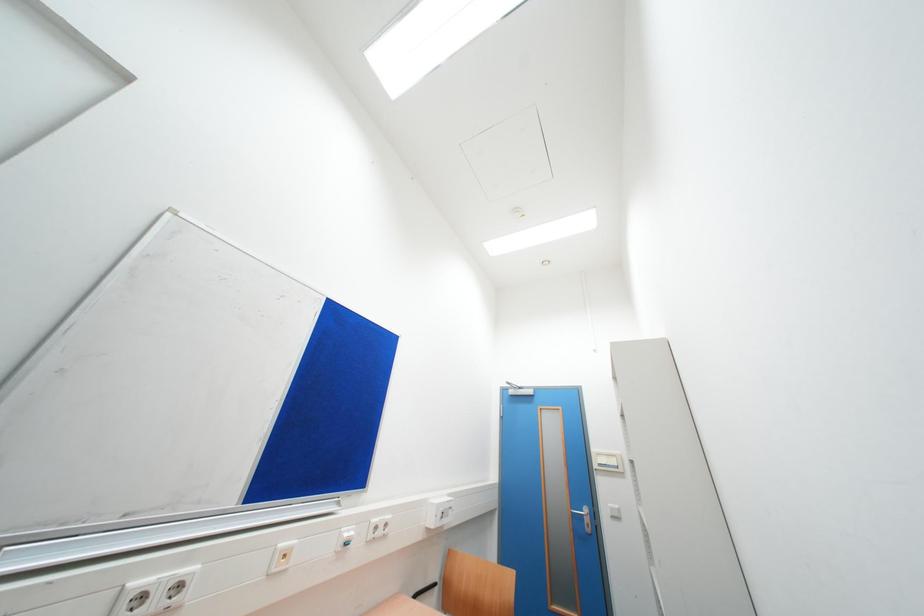
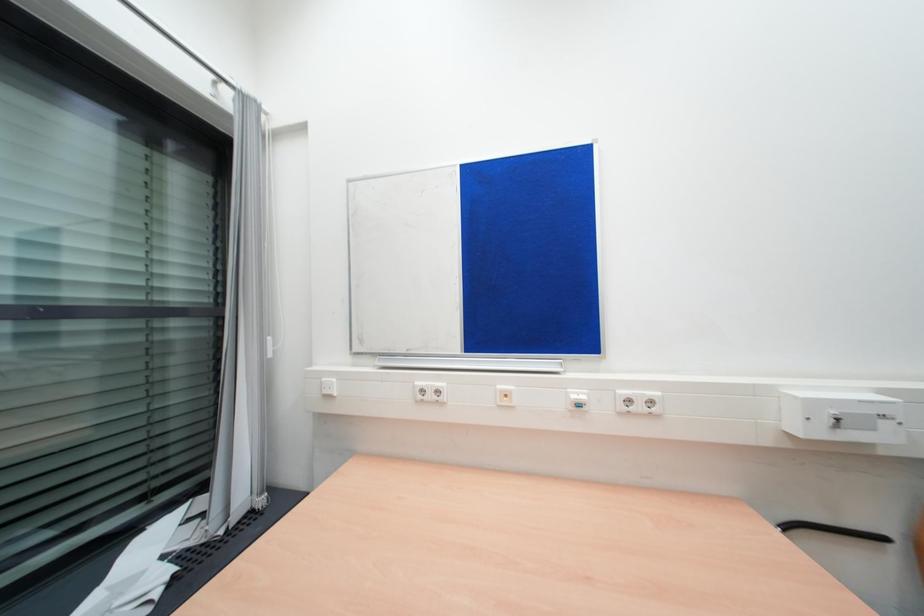
Question: How did the camera likely rotate?

Choices:
 (A) Left
 (B) Right
 (C) Up
 (D) Down

Answer: (A)